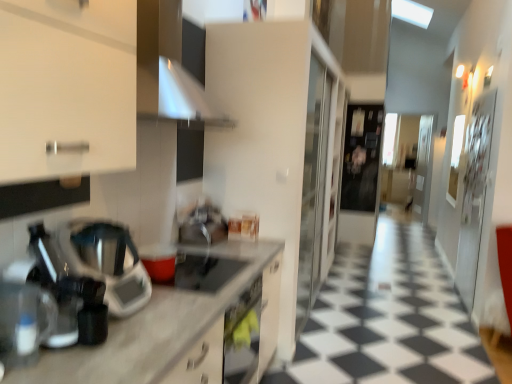
Question: Considering the positions of point (181, 256) and point (124, 319), is point (181, 256) closer or farther from the camera than point (124, 319)?

Choices:
 (A) closer
 (B) farther

Answer: (B)

Question: In the image, is matte black gas stove at center positioned in front of or behind white marble countertop at left?

Choices:
 (A) front
 (B) behind

Answer: (B)

Question: Considering the real-world distances, which object is farthest from the matte black gas stove at center?

Choices:
 (A) black glossy tile at center
 (B) metallic silver blender at left
 (C) sleek metallic coffee machine at left, which ranks as the first coffee machine in back-to-front order
 (D) white marble countertop at left
 (E) satin silver exhaust hood at upper center

Answer: (A)

Question: Which is nearer to the satin silver sink at center?

Choices:
 (A) metallic silver blender at left
 (B) black glossy tile at center
 (C) transparent plastic coffee machine at left, which is counted as the 1th coffee machine, starting from the front
 (D) satin silver exhaust hood at upper center
 (E) matte black gas stove at center

Answer: (E)